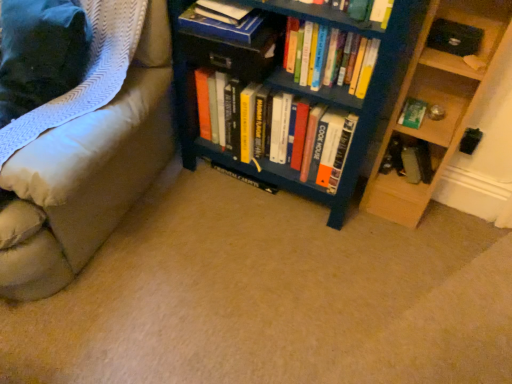
Question: Is the surface of wooden at right in direct contact with hardcover book at upper center, which appears as the 6th book when viewed from the right?

Choices:
 (A) no
 (B) yes

Answer: (A)

Question: Is the position of wooden at right more distant than that of hardcover book at upper center, the 1th book viewed from the left?

Choices:
 (A) no
 (B) yes

Answer: (A)

Question: Is wooden at right turned away from hardcover book at upper center, the 1th book viewed from the left?

Choices:
 (A) no
 (B) yes

Answer: (A)

Question: Is wooden at right to the right of hardcover book at upper center, which appears as the 6th book when viewed from the right, from the viewer's perspective?

Choices:
 (A) yes
 (B) no

Answer: (A)

Question: From a real-world perspective, is wooden at right positioned over hardcover book at upper center, the 1th book viewed from the left, based on gravity?

Choices:
 (A) yes
 (B) no

Answer: (B)

Question: Considering the positions of blue painted wood bookcase at center and blue matte bookshelf at center in the image, is blue painted wood bookcase at center wider or thinner than blue matte bookshelf at center?

Choices:
 (A) thin
 (B) wide

Answer: (A)

Question: Considering their positions, is blue painted wood bookcase at center located in front of or behind blue matte bookshelf at center?

Choices:
 (A) behind
 (B) front

Answer: (A)

Question: In terms of size, does blue painted wood bookcase at center appear bigger or smaller than blue matte bookshelf at center?

Choices:
 (A) big
 (B) small

Answer: (A)

Question: In the image, is blue painted wood bookcase at center on the left side or the right side of blue matte bookshelf at center?

Choices:
 (A) left
 (B) right

Answer: (B)

Question: From the image's perspective, is hardcover books at center, which is the third book in right-to-left order, above or below blue painted wood bookcase at center?

Choices:
 (A) above
 (B) below

Answer: (A)

Question: Is hardcover books at center, the fourth book from the left, in front of or behind blue painted wood bookcase at center in the image?

Choices:
 (A) front
 (B) behind

Answer: (B)

Question: Considering the positions of point (343, 38) and point (301, 183), is point (343, 38) closer or farther from the camera than point (301, 183)?

Choices:
 (A) closer
 (B) farther

Answer: (A)

Question: Considering the positions of hardcover books at center, the fourth book from the left, and blue painted wood bookcase at center in the image, is hardcover books at center, the fourth book from the left, wider or thinner than blue painted wood bookcase at center?

Choices:
 (A) wide
 (B) thin

Answer: (B)

Question: Looking at their shapes, would you say white textured blanket at left is wider or thinner than wooden at right?

Choices:
 (A) wide
 (B) thin

Answer: (A)

Question: Looking at the image, does white textured blanket at left seem bigger or smaller compared to wooden at right?

Choices:
 (A) big
 (B) small

Answer: (A)